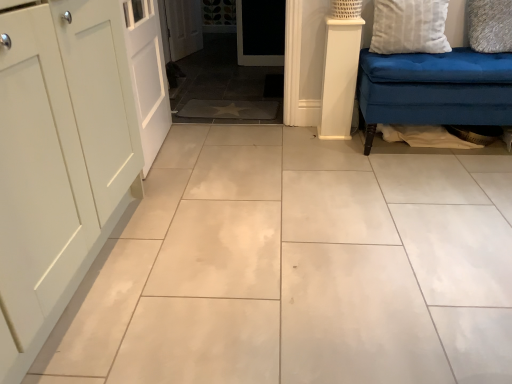
The image size is (512, 384). What do you see at coordinates (490, 25) in the screenshot?
I see `white textured pillow at upper right, positioned as the 1th pillow in right-to-left order` at bounding box center [490, 25].

The height and width of the screenshot is (384, 512). In order to click on white textured pillow at upper right, positioned as the 1th pillow in right-to-left order in this screenshot , I will do `click(490, 25)`.

This screenshot has width=512, height=384. What do you see at coordinates (409, 27) in the screenshot? I see `white textured pillow at upper right, the 1th pillow positioned from the left` at bounding box center [409, 27].

Locate an element on the screen. The height and width of the screenshot is (384, 512). white smooth column at right is located at coordinates (339, 77).

The image size is (512, 384). What do you see at coordinates (339, 77) in the screenshot?
I see `white smooth column at right` at bounding box center [339, 77].

I want to click on white textured pillow at upper right, which ranks as the second pillow in left-to-right order, so click(x=490, y=25).

Between white textured pillow at upper right, positioned as the 1th pillow in right-to-left order, and white smooth column at right, which one appears on the right side from the viewer's perspective?

Positioned to the right is white textured pillow at upper right, positioned as the 1th pillow in right-to-left order.

Can you tell me how much white textured pillow at upper right, which ranks as the second pillow in left-to-right order, and white smooth column at right differ in facing direction?

There is a 5.34-degree angle between the facing directions of white textured pillow at upper right, which ranks as the second pillow in left-to-right order, and white smooth column at right.

From a real-world perspective, is white textured pillow at upper right, positioned as the 1th pillow in right-to-left order, physically located above or below white smooth column at right?

white textured pillow at upper right, positioned as the 1th pillow in right-to-left order, is above white smooth column at right.

Considering the points (498, 8) and (349, 132), which point is in front, point (498, 8) or point (349, 132)?

The point (498, 8) is in front.

Is white painted wood door at left situated inside white textured pillow at upper right, the 1th pillow positioned from the left, or outside?

white painted wood door at left is outside white textured pillow at upper right, the 1th pillow positioned from the left.

From a real-world perspective, is white painted wood door at left located beneath white textured pillow at upper right, arranged as the 2th pillow when viewed from the right?

Yes, from a real-world perspective, white painted wood door at left is beneath white textured pillow at upper right, arranged as the 2th pillow when viewed from the right.

Is white painted wood door at left bigger than white textured pillow at upper right, the 1th pillow positioned from the left?

Correct, white painted wood door at left is larger in size than white textured pillow at upper right, the 1th pillow positioned from the left.

From a real-world perspective, does white smooth column at right sit lower than white painted wood door at left?

Yes.

In the scene shown: Between white smooth column at right and white painted wood door at left, which one has more height?

Standing taller between the two is white painted wood door at left.

Considering the relative sizes of white smooth column at right and white painted wood door at left in the image provided, is white smooth column at right wider than white painted wood door at left?

Indeed, white smooth column at right has a greater width compared to white painted wood door at left.

Is white smooth column at right behind white painted wood door at left?

Yes, white smooth column at right is further from the viewer.

Does white painted wood door at left touch white textured pillow at upper right, which ranks as the second pillow in left-to-right order?

No.

Is white painted wood door at left closer to the viewer compared to white textured pillow at upper right, positioned as the 1th pillow in right-to-left order?

That is True.

Choose the correct answer: Is white painted wood door at left inside white textured pillow at upper right, positioned as the 1th pillow in right-to-left order, or outside it?

white painted wood door at left is outside white textured pillow at upper right, positioned as the 1th pillow in right-to-left order.

From the image's perspective, which object appears higher, white painted wood door at left or white textured pillow at upper right, positioned as the 1th pillow in right-to-left order?

white textured pillow at upper right, positioned as the 1th pillow in right-to-left order, appears higher in the image.

Is white textured pillow at upper right, which ranks as the second pillow in left-to-right order, turned away from white textured pillow at upper right, arranged as the 2th pillow when viewed from the right?

white textured pillow at upper right, which ranks as the second pillow in left-to-right order, does not have its back to white textured pillow at upper right, arranged as the 2th pillow when viewed from the right.

Where is `pillow on the right of white textured pillow at upper right, the 1th pillow positioned from the left`? The width and height of the screenshot is (512, 384). pillow on the right of white textured pillow at upper right, the 1th pillow positioned from the left is located at coordinates (490, 25).

Is white textured pillow at upper right, the 1th pillow positioned from the left, inside white textured pillow at upper right, which ranks as the second pillow in left-to-right order?

No, white textured pillow at upper right, the 1th pillow positioned from the left, is located outside of white textured pillow at upper right, which ranks as the second pillow in left-to-right order.

Looking at this image, considering the relative positions of white painted wood door at left and white smooth column at right in the image provided, is white painted wood door at left to the right of white smooth column at right from the viewer's perspective?

No, white painted wood door at left is not to the right of white smooth column at right.

Who is taller, white painted wood door at left or white smooth column at right?

white painted wood door at left is taller.

Does point (125, 20) come farther from viewer compared to point (325, 62)?

No, (125, 20) is in front of (325, 62).

In the scene shown: Would you say white smooth column at right is part of white painted wood door at left's contents?

No, white smooth column at right is located outside of white painted wood door at left.

Measure the distance from white textured pillow at upper right, which ranks as the second pillow in left-to-right order, to white painted wood door at left.

They are 5.79 feet apart.

How different are the orientations of white textured pillow at upper right, which ranks as the second pillow in left-to-right order, and white painted wood door at left in degrees?

The angular difference between white textured pillow at upper right, which ranks as the second pillow in left-to-right order, and white painted wood door at left is 89.5 degrees.

Is white textured pillow at upper right, positioned as the 1th pillow in right-to-left order, in contact with white painted wood door at left?

No, white textured pillow at upper right, positioned as the 1th pillow in right-to-left order, is not next to white painted wood door at left.

Considering the sizes of objects white textured pillow at upper right, positioned as the 1th pillow in right-to-left order, and white painted wood door at left in the image provided, who is shorter, white textured pillow at upper right, positioned as the 1th pillow in right-to-left order, or white painted wood door at left?

With less height is white textured pillow at upper right, positioned as the 1th pillow in right-to-left order.

This screenshot has width=512, height=384. I want to click on the 1st pillow directly above the white smooth column at right (from a real-world perspective), so pyautogui.click(x=490, y=25).

What are the coordinates of `door below the white textured pillow at upper right, the 1th pillow positioned from the left (from the image's perspective)` in the screenshot? It's located at (147, 74).

Which object lies nearer to the anchor point white smooth column at right, white textured pillow at upper right, positioned as the 1th pillow in right-to-left order, or white textured pillow at upper right, the 1th pillow positioned from the left?

Based on the image, white textured pillow at upper right, the 1th pillow positioned from the left, appears to be nearer to white smooth column at right.

Based on the photo, considering their positions, is white smooth column at right positioned further to white textured pillow at upper right, positioned as the 1th pillow in right-to-left order, than white textured pillow at upper right, arranged as the 2th pillow when viewed from the right?

white smooth column at right is further to white textured pillow at upper right, positioned as the 1th pillow in right-to-left order.

From the image, which object appears to be nearer to white textured pillow at upper right, the 1th pillow positioned from the left, white painted wood door at left or white smooth column at right?

white smooth column at right lies closer to white textured pillow at upper right, the 1th pillow positioned from the left, than the other object.

Based on their spatial positions, is white smooth column at right or white textured pillow at upper right, positioned as the 1th pillow in right-to-left order, closer to white painted wood door at left?

Among the two, white smooth column at right is located nearer to white painted wood door at left.

When comparing their distances from white textured pillow at upper right, which ranks as the second pillow in left-to-right order, does white textured pillow at upper right, arranged as the 2th pillow when viewed from the right, or white painted wood door at left seem further?

Among the two, white painted wood door at left is located further to white textured pillow at upper right, which ranks as the second pillow in left-to-right order.

Estimate the real-world distances between objects in this image. Which object is closer to white textured pillow at upper right, the 1th pillow positioned from the left, white painted wood door at left or white textured pillow at upper right, which ranks as the second pillow in left-to-right order?

white textured pillow at upper right, which ranks as the second pillow in left-to-right order.

Based on their spatial positions, is white textured pillow at upper right, positioned as the 1th pillow in right-to-left order, or white smooth column at right further from white painted wood door at left?

Among the two, white textured pillow at upper right, positioned as the 1th pillow in right-to-left order, is located further to white painted wood door at left.

When comparing their distances from white painted wood door at left, does white smooth column at right or white textured pillow at upper right, the 1th pillow positioned from the left, seem closer?

Among the two, white smooth column at right is located nearer to white painted wood door at left.

The width and height of the screenshot is (512, 384). What are the coordinates of `pillow located between white painted wood door at left and white textured pillow at upper right, positioned as the 1th pillow in right-to-left order, in the left-right direction` in the screenshot? It's located at (409, 27).

Where is `pillar between white painted wood door at left and white textured pillow at upper right, arranged as the 2th pillow when viewed from the right, in the horizontal direction`? This screenshot has height=384, width=512. pillar between white painted wood door at left and white textured pillow at upper right, arranged as the 2th pillow when viewed from the right, in the horizontal direction is located at coordinates (339, 77).

Locate an element on the screen. The width and height of the screenshot is (512, 384). pillar between white painted wood door at left and white textured pillow at upper right, which ranks as the second pillow in left-to-right order, from left to right is located at coordinates (339, 77).

You are a GUI agent. You are given a task and a screenshot of the screen. Output one action in this format:
    pyautogui.click(x=<x>, y=<y>)
    Task: Click on the pillow located between white smooth column at right and white textured pillow at upper right, which ranks as the second pillow in left-to-right order, in the left-right direction
    
    Given the screenshot: What is the action you would take?
    pyautogui.click(x=409, y=27)